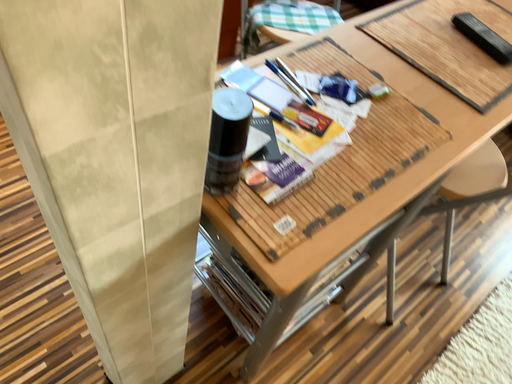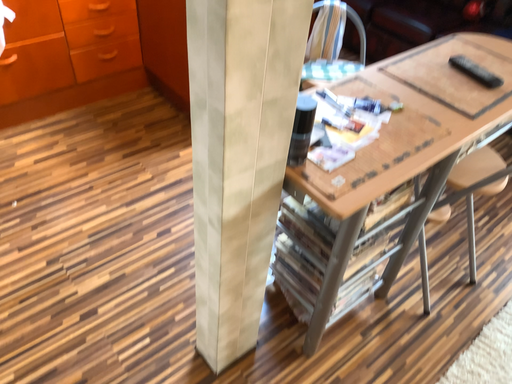
Question: How did the camera likely rotate when shooting the video?

Choices:
 (A) rotated upward
 (B) rotated downward

Answer: (A)